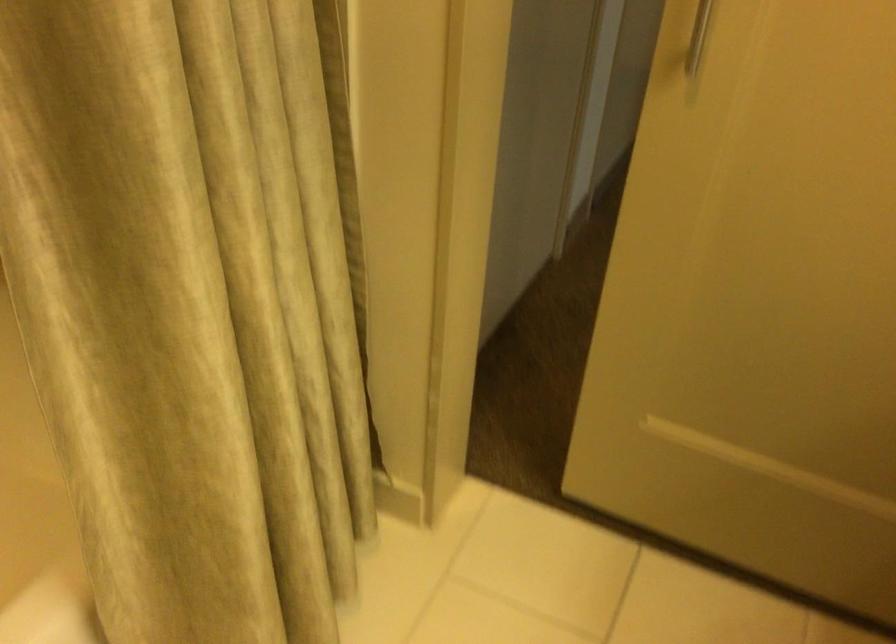
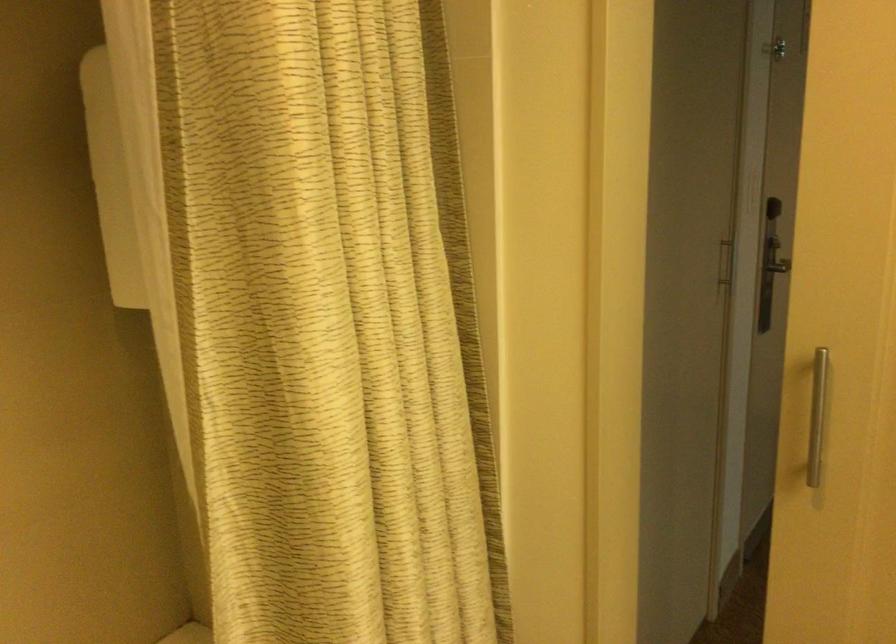
Question: What movement of the cameraman would produce the second image?

Choices:
 (A) Left
 (B) Right
 (C) Forward
 (D) Backward

Answer: (D)